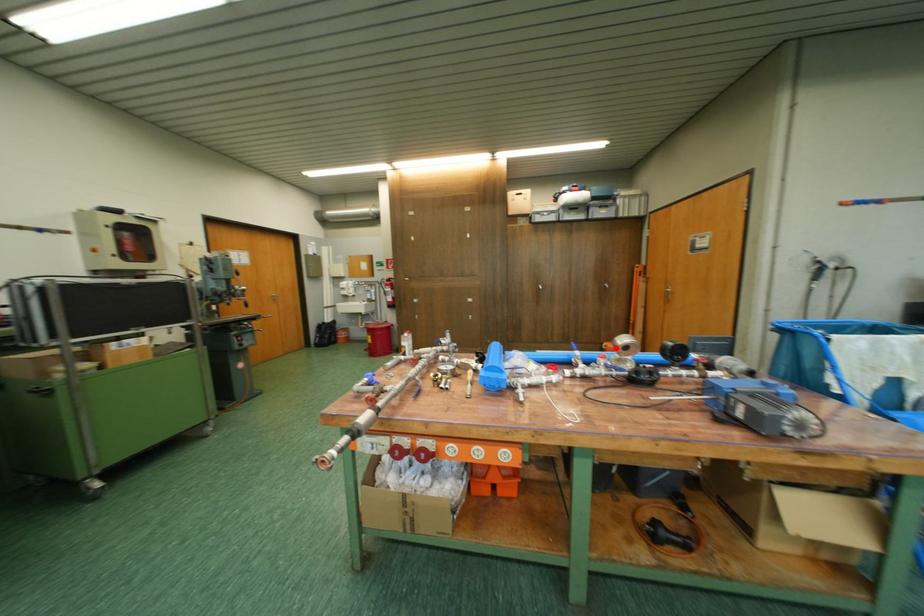
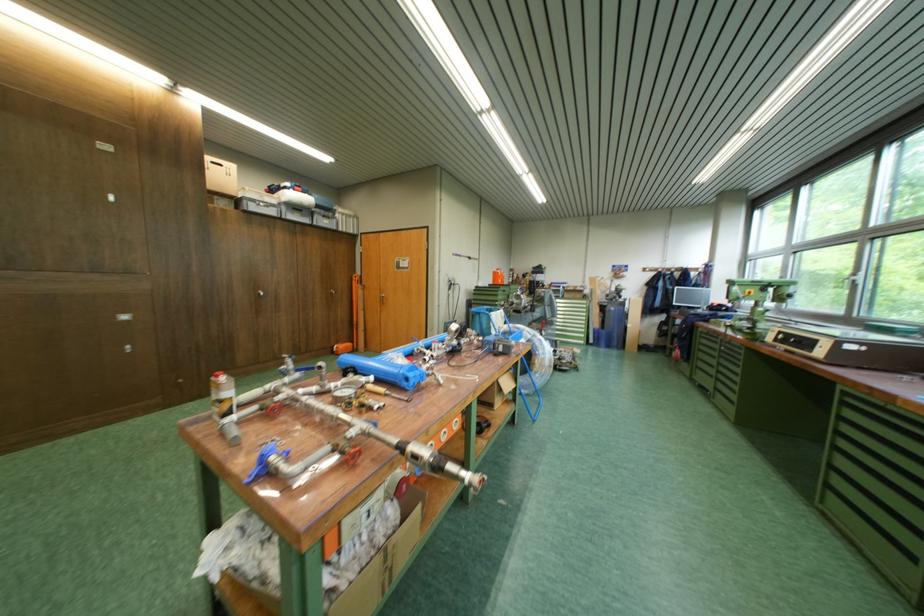
The point at the highlighted location is marked in the first image. Where is the corresponding point in the second image?

(347, 350)